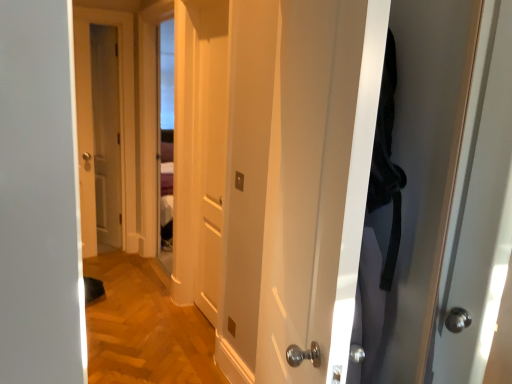
Question: Could you tell me if white glossy door at center, which is the 1th door in right-to-left order, is facing white matte door at center, placed as the 2th door when sorted from back to front?

Choices:
 (A) yes
 (B) no

Answer: (B)

Question: Can you confirm if white glossy door at center, which is counted as the third door, starting from the back, is taller than white matte door at center, placed as the second door when sorted from left to right?

Choices:
 (A) yes
 (B) no

Answer: (B)

Question: From a real-world perspective, is white glossy door at center, positioned as the 3th door in left-to-right order, on white matte door at center, placed as the 2th door when sorted from back to front?

Choices:
 (A) no
 (B) yes

Answer: (B)

Question: Is white glossy door at center, positioned as the 3th door in left-to-right order, shorter than white matte door at center, the second door in the front-to-back sequence?

Choices:
 (A) no
 (B) yes

Answer: (B)

Question: From the image's perspective, is white glossy door at center, which is the 1th door in right-to-left order, under white matte door at center, placed as the 2th door when sorted from back to front?

Choices:
 (A) yes
 (B) no

Answer: (A)

Question: Is white glossy door at center, which is counted as the third door, starting from the back, in front of or behind matte wooden door at left, which is the 1th door in left-to-right order, in the image?

Choices:
 (A) front
 (B) behind

Answer: (A)

Question: Based on their sizes in the image, would you say white glossy door at center, which is counted as the third door, starting from the back, is bigger or smaller than matte wooden door at left, the first door positioned from the back?

Choices:
 (A) small
 (B) big

Answer: (B)

Question: Is point (291, 54) positioned closer to the camera than point (87, 246)?

Choices:
 (A) farther
 (B) closer

Answer: (B)

Question: Looking at their shapes, would you say white glossy door at center, which is the 1th door in right-to-left order, is wider or thinner than matte wooden door at left, the third door in the front-to-back sequence?

Choices:
 (A) wide
 (B) thin

Answer: (A)

Question: From a real-world perspective, is white glossy door at center, which is the 1th door in right-to-left order, above or below white matte door at center, the second door in the front-to-back sequence?

Choices:
 (A) above
 (B) below

Answer: (A)

Question: Based on their positions, is white glossy door at center, which is counted as the third door, starting from the back, located to the left or right of white matte door at center, the second door in the front-to-back sequence?

Choices:
 (A) left
 (B) right

Answer: (B)

Question: Based on their sizes in the image, would you say white glossy door at center, positioned as the 3th door in left-to-right order, is bigger or smaller than white matte door at center, the second door in the front-to-back sequence?

Choices:
 (A) big
 (B) small

Answer: (A)

Question: Is white glossy door at center, which is the 1th door in right-to-left order, inside or outside of white matte door at center, acting as the second door starting from the right?

Choices:
 (A) inside
 (B) outside

Answer: (B)

Question: Is white matte door at center, placed as the second door when sorted from left to right, bigger or smaller than matte wooden door at left, the first door positioned from the back?

Choices:
 (A) big
 (B) small

Answer: (A)

Question: Does point (202, 309) appear closer or farther from the camera than point (89, 134)?

Choices:
 (A) closer
 (B) farther

Answer: (A)